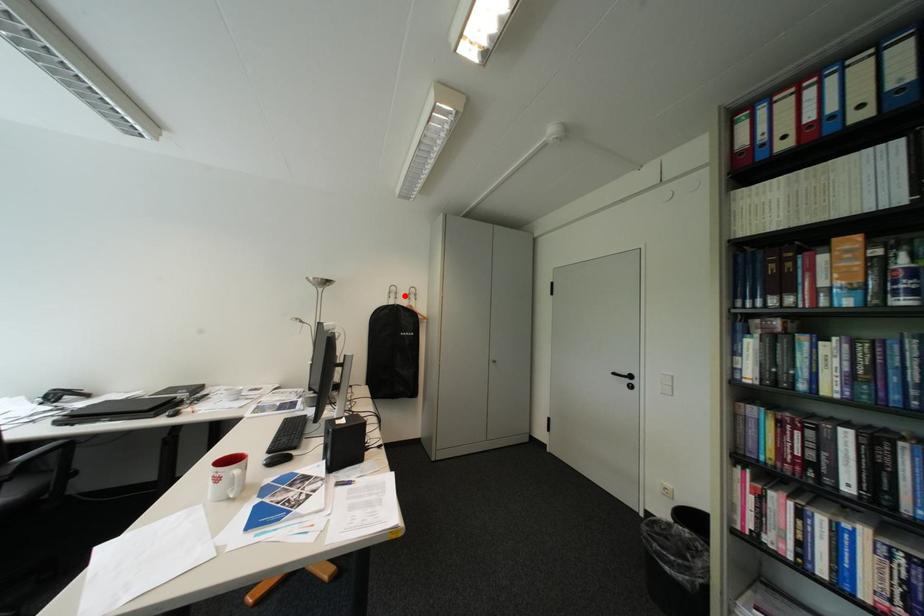
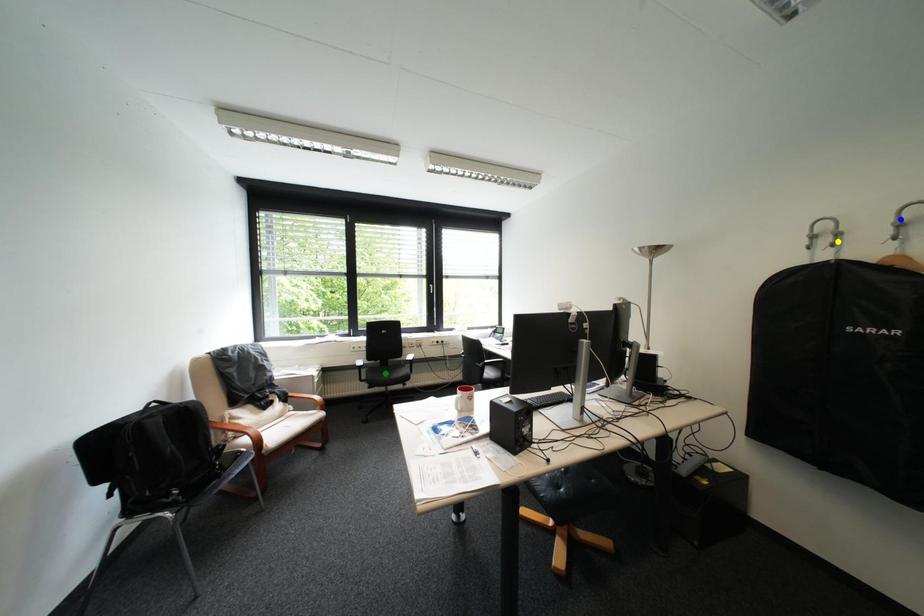
Question: I am providing you with two images of the same scene from different viewpoints. A red point is marked on the first image. You are given multiple points on the second image. Can you choose the point in image 2 that corresponds to the point in image 1?

Choices:
 (A) green point
 (B) yellow point
 (C) blue point

Answer: (B)